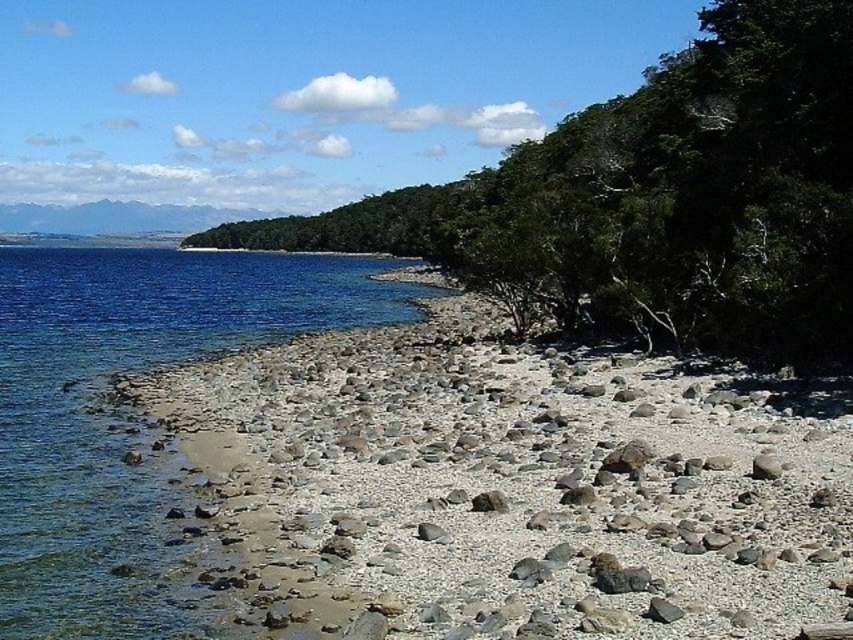
You are standing on the gray smooth rock at center and want to reach the blue water at lower left. Which direction should you move to get there?

The blue water at lower left is above the gray smooth rock at center, so you should move upward to reach it.